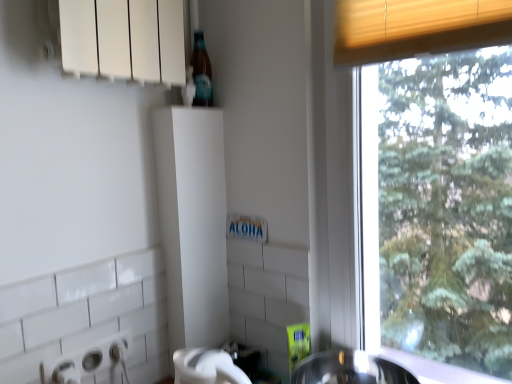
Question: In terms of size, does shiny metallic sink at lower center appear bigger or smaller than translucent glass bottle at upper center?

Choices:
 (A) small
 (B) big

Answer: (B)

Question: In terms of height, does shiny metallic sink at lower center look taller or shorter compared to translucent glass bottle at upper center?

Choices:
 (A) tall
 (B) short

Answer: (B)

Question: Which object is positioned farthest from the translucent glass bottle at upper center?

Choices:
 (A) white plastic bottle at upper center
 (B) shiny metallic sink at lower center

Answer: (B)

Question: Which object is positioned farthest from the white plastic bottle at upper center?

Choices:
 (A) shiny metallic sink at lower center
 (B) translucent glass bottle at upper center

Answer: (A)